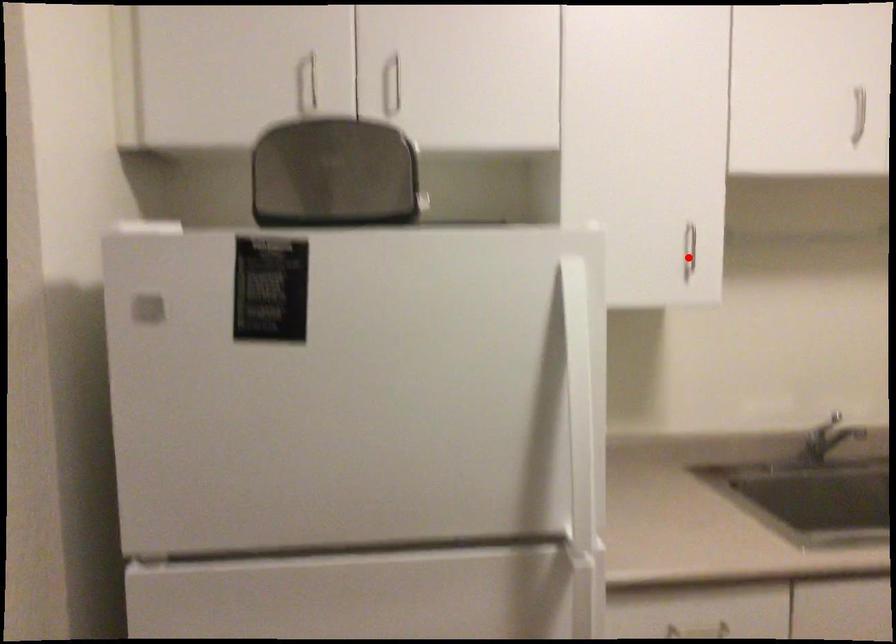
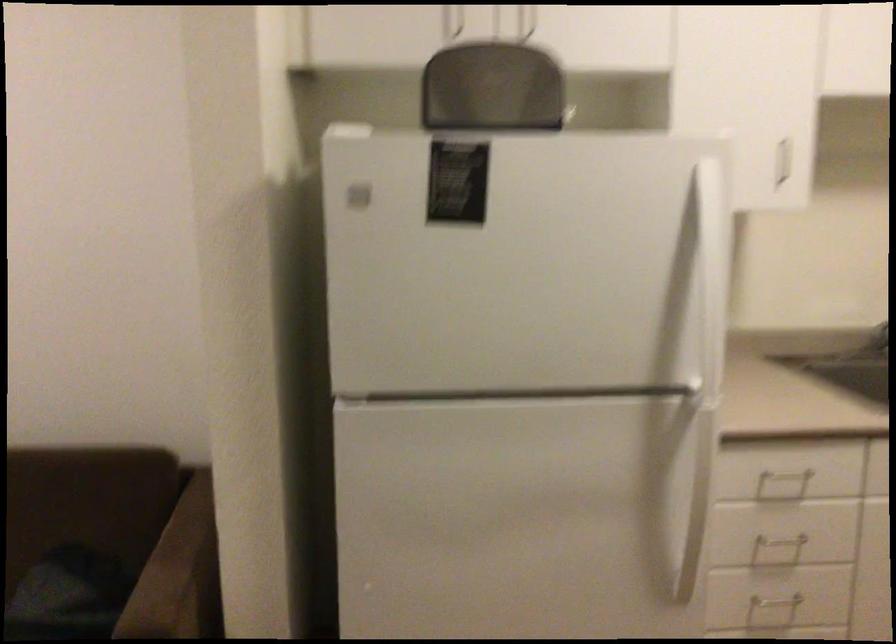
Question: I am providing you with two images of the same scene from different viewpoints. Given a red point in image1, look at the same physical point in image2. Is it:

Choices:
 (A) Closer to the viewpoint
 (B) Farther from the viewpoint

Answer: (B)